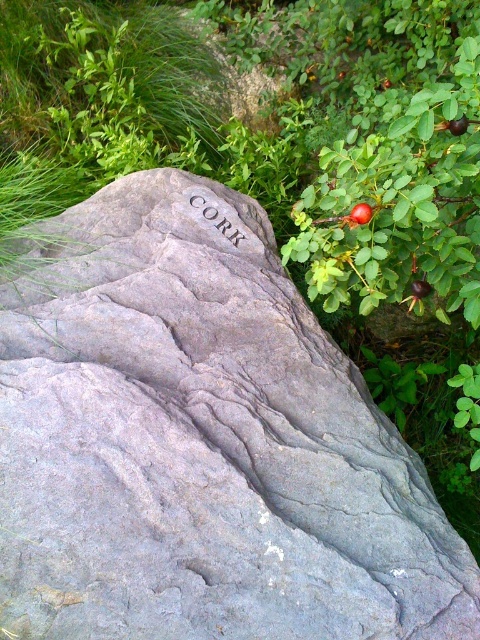
Question: Is shiny red rosehip at upper right smaller than shiny brown rosehip at upper right?

Choices:
 (A) yes
 (B) no

Answer: (B)

Question: Which point is closer to the camera?

Choices:
 (A) glossy red rosehip at upper right
 (B) gray stone engraving at center
 (C) shiny brown rosehip at upper right
 (D) gray rock at center

Answer: (D)

Question: Which point is farther from the camera taking this photo?

Choices:
 (A) (367, 209)
 (B) (236, 241)
 (C) (131, 317)

Answer: (B)

Question: Which point is farther from the camera taking this photo?

Choices:
 (A) (411, 291)
 (B) (456, 120)
 (C) (369, 205)
 (D) (216, 225)

Answer: (D)

Question: Is gray stone engraving at center positioned in front of shiny red rosehip at upper right?

Choices:
 (A) yes
 (B) no

Answer: (B)

Question: Is gray rock at center smaller than shiny red rosehip at upper right?

Choices:
 (A) no
 (B) yes

Answer: (A)